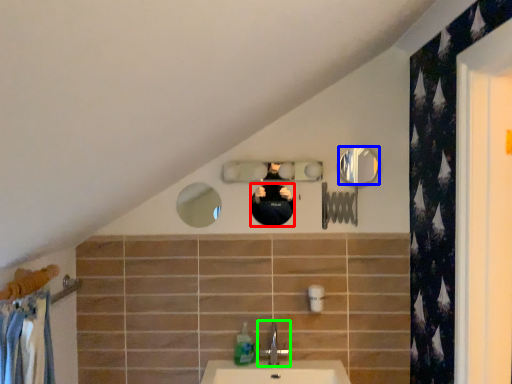
Question: Which object is the farthest from mirror (highlighted by a red box)? Choose among these: mirror (highlighted by a blue box) or tap (highlighted by a green box).

Choices:
 (A) mirror
 (B) tap

Answer: (B)